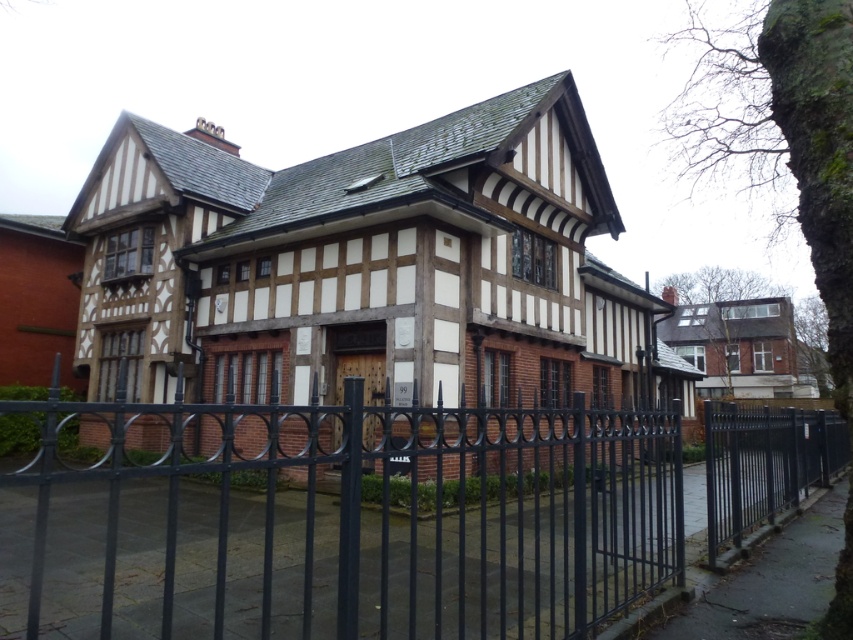
Question: Is black metal fence at center wider than black metal fence at right?

Choices:
 (A) no
 (B) yes

Answer: (B)

Question: Among these points, which one is farthest from the camera?

Choices:
 (A) (801, 420)
 (B) (164, 557)

Answer: (A)

Question: Among these points, which one is nearest to the camera?

Choices:
 (A) (33, 557)
 (B) (715, 442)

Answer: (A)

Question: Is black metal fence at center thinner than black metal fence at right?

Choices:
 (A) no
 (B) yes

Answer: (A)

Question: Does black metal fence at center appear on the left side of black metal fence at right?

Choices:
 (A) no
 (B) yes

Answer: (B)